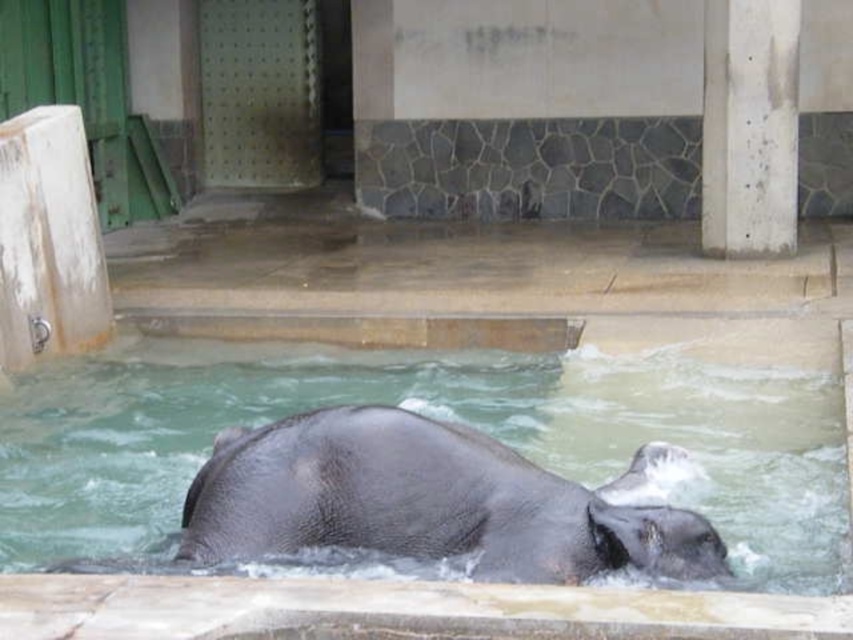
You are a zookeeper observing the elephant in its enclosure. You notice the gray matte water at center and the gray textured elephant at center. Which object is located to the left when viewed from your perspective?

The gray matte water at center is positioned on the left side of the gray textured elephant at center, so the gray matte water at center is to the left.

You are a zookeeper planning to move the gray textured elephant at center to a new enclosure. The entrance to the new enclosure has a doorway that is the same width as the white concrete pillar at upper right. Will the elephant fit through the doorway?

The gray textured elephant at center is wider than the white concrete pillar at upper right. Since the doorway is the same width as the pillar, the elephant will not fit through the doorway.

You are a zookeeper standing near the elephant enclosure. You need to place a new sign on the white concrete pillar at upper right. However, you notice the gray matte water at center might block the view of the sign. Based on the scene, will the sign be visible from the front of the enclosure?

The gray matte water at center is in front of the white concrete pillar at upper right, so the water would block the view of the sign placed on the pillar. Therefore, the sign will not be fully visible from the front of the enclosure.